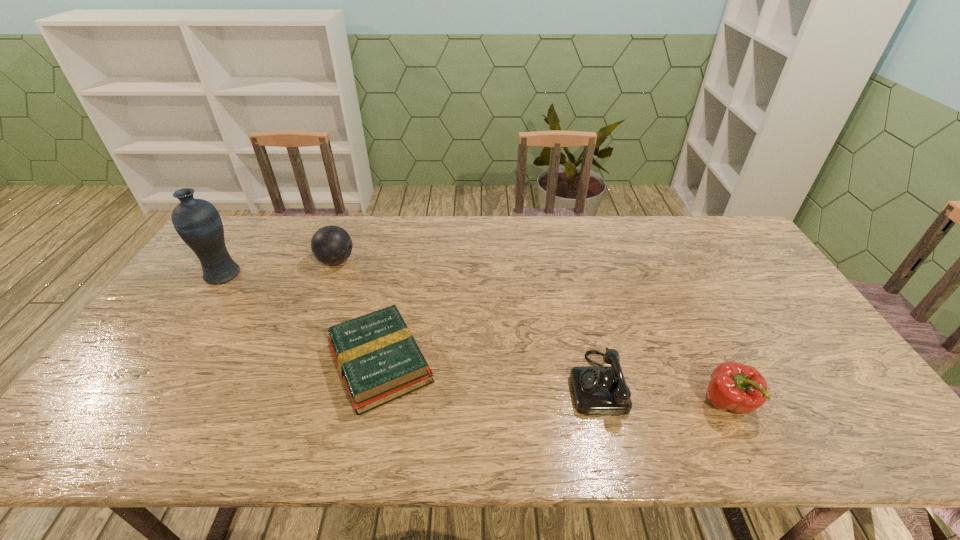
I want to click on free spot between the leftmost object and the second object from right to left, so click(410, 328).

At what (x,y) coordinates should I click in order to perform the action: click on vacant space that's between the pepper and the hardback book. Please return your answer as a coordinate pair (x, y). The width and height of the screenshot is (960, 540). Looking at the image, I should click on (554, 383).

Identify the location of free space between the fourth tallest object and the vase. Image resolution: width=960 pixels, height=540 pixels. (410, 328).

Identify which object is the third closest to the rightmost object. Please provide its 2D coordinates. Your answer should be formatted as a tuple, i.e. [(x, y)], where the tuple contains the x and y coordinates of a point satisfying the conditions above.

[(331, 245)]

Locate which object ranks second in proximity to the tallest object. Please provide its 2D coordinates. Your answer should be formatted as a tuple, i.e. [(x, y)], where the tuple contains the x and y coordinates of a point satisfying the conditions above.

[(378, 359)]

What are the coordinates of `vacant space that satisfies the following two spatial constraints: 1. on the grip area of the third object from left to right; 2. on the left side of the fourth object from right to left` in the screenshot? It's located at (297, 363).

Find the location of `free space that satisfies the following two spatial constraints: 1. on the dial of the telephone; 2. on the back side of the rightmost object`. free space that satisfies the following two spatial constraints: 1. on the dial of the telephone; 2. on the back side of the rightmost object is located at coordinates (601, 403).

Identify the location of blank space that satisfies the following two spatial constraints: 1. on the back side of the rightmost object; 2. on the grip area of the second object from left to right. (659, 261).